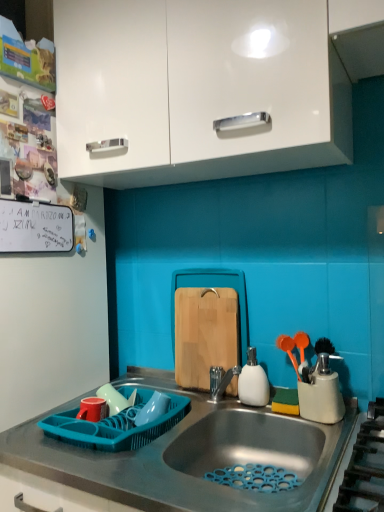
Question: Considering the relative sizes of white glossy cabinet at upper center and gray matte countertop at center in the image provided, is white glossy cabinet at upper center smaller than gray matte countertop at center?

Choices:
 (A) yes
 (B) no

Answer: (A)

Question: From a real-world perspective, is white glossy cabinet at upper center on gray matte countertop at center?

Choices:
 (A) yes
 (B) no

Answer: (A)

Question: Does white glossy cabinet at upper center have a lesser width compared to gray matte countertop at center?

Choices:
 (A) no
 (B) yes

Answer: (B)

Question: Is white glossy cabinet at upper center to the left of gray matte countertop at center from the viewer's perspective?

Choices:
 (A) no
 (B) yes

Answer: (A)

Question: Is white glossy cabinet at upper center not inside gray matte countertop at center?

Choices:
 (A) yes
 (B) no

Answer: (A)

Question: Visually, is teal plastic dish rack at lower left, acting as the 1th appliance starting from the left, positioned to the left or to the right of natural wood cutting board at center?

Choices:
 (A) left
 (B) right

Answer: (A)

Question: Relative to natural wood cutting board at center, is teal plastic dish rack at lower left, positioned as the 2th appliance in top-to-bottom order, in front or behind?

Choices:
 (A) front
 (B) behind

Answer: (A)

Question: From a real-world perspective, is teal plastic dish rack at lower left, positioned as the 2th appliance in top-to-bottom order, physically located above or below natural wood cutting board at center?

Choices:
 (A) below
 (B) above

Answer: (A)

Question: In terms of height, does teal plastic dish rack at lower left, acting as the 1th appliance starting from the left, look taller or shorter compared to natural wood cutting board at center?

Choices:
 (A) tall
 (B) short

Answer: (B)

Question: Considering the positions of point (137, 375) and point (208, 324), is point (137, 375) closer or farther from the camera than point (208, 324)?

Choices:
 (A) closer
 (B) farther

Answer: (B)

Question: Looking at their shapes, would you say gray matte countertop at center is wider or thinner than natural wood cutting board at center?

Choices:
 (A) wide
 (B) thin

Answer: (A)

Question: Considering the relative positions of gray matte countertop at center and natural wood cutting board at center in the image provided, is gray matte countertop at center to the left or to the right of natural wood cutting board at center?

Choices:
 (A) left
 (B) right

Answer: (A)

Question: Based on their sizes in the image, would you say gray matte countertop at center is bigger or smaller than natural wood cutting board at center?

Choices:
 (A) big
 (B) small

Answer: (A)

Question: Looking at the image, does gray matte countertop at center seem bigger or smaller compared to white matte soap dispenser at sink, which is the 2th appliance in left-to-right order?

Choices:
 (A) big
 (B) small

Answer: (A)

Question: In the image, is gray matte countertop at center positioned in front of or behind white matte soap dispenser at sink, arranged as the second appliance when ordered from the bottom?

Choices:
 (A) behind
 (B) front

Answer: (B)